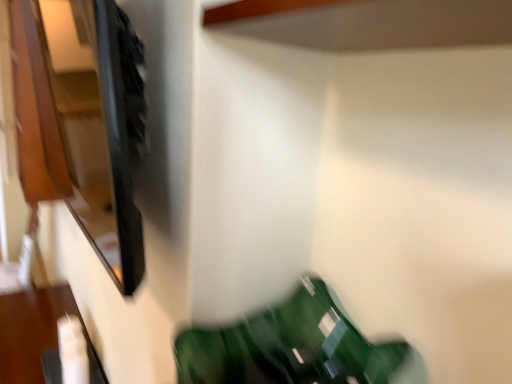
Question: From the image's perspective, is matte black cabinet at upper left located above or below green glossy bean bag chair at lower center?

Choices:
 (A) above
 (B) below

Answer: (A)

Question: In terms of height, does matte black cabinet at upper left look taller or shorter compared to green glossy bean bag chair at lower center?

Choices:
 (A) tall
 (B) short

Answer: (A)

Question: Estimate the real-world distances between objects in this image. Which object is farther from the matte black cabinet at upper left?

Choices:
 (A) green glossy bean bag chair at lower center
 (B) white glossy remote control at lower left

Answer: (A)

Question: Estimate the real-world distances between objects in this image. Which object is farther from the white glossy remote control at lower left?

Choices:
 (A) green glossy bean bag chair at lower center
 (B) matte black cabinet at upper left

Answer: (B)